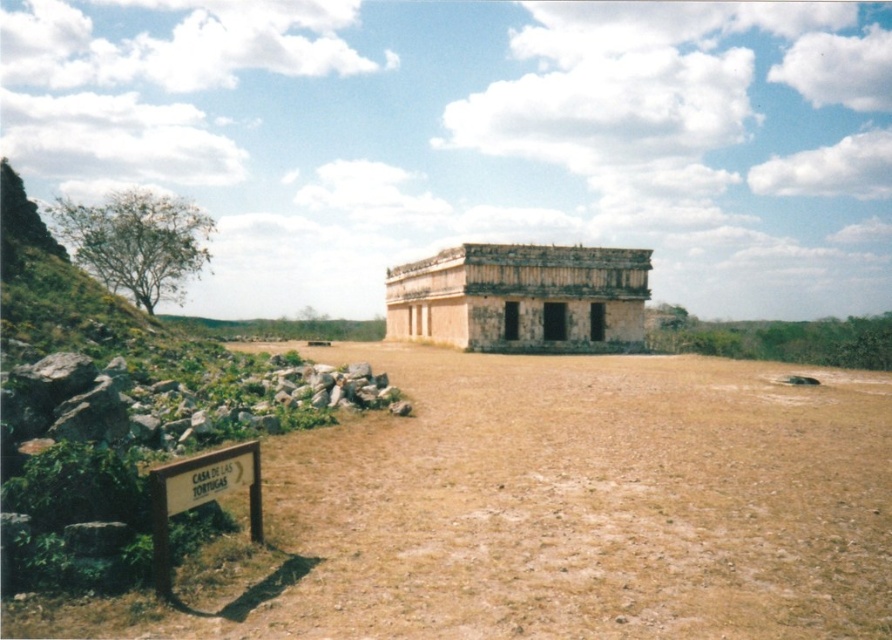
Can you confirm if brown sandy dirt field at center is taller than brown stone at lower left?

Correct, brown sandy dirt field at center is much taller as brown stone at lower left.

At what (x,y) coordinates should I click in order to perform the action: click on brown sandy dirt field at center. Please return your answer as a coordinate pair (x, y). This screenshot has width=892, height=640. Looking at the image, I should click on (558, 509).

Describe the element at coordinates (558, 509) in the screenshot. The height and width of the screenshot is (640, 892). I see `brown sandy dirt field at center` at that location.

This screenshot has height=640, width=892. Find the location of `brown sandy dirt field at center`. brown sandy dirt field at center is located at coordinates (558, 509).

Does brown sandy dirt field at center have a greater width compared to gray rock pile at lower left?

Correct, the width of brown sandy dirt field at center exceeds that of gray rock pile at lower left.

Between brown sandy dirt field at center and gray rock pile at lower left, which one appears on the right side from the viewer's perspective?

From the viewer's perspective, brown sandy dirt field at center appears more on the right side.

Which is in front, point (435, 500) or point (21, 435)?

Point (21, 435) is more forward.

Find the location of a particular element. This screenshot has width=892, height=640. brown sandy dirt field at center is located at coordinates (558, 509).

In the scene shown: Is gray rock pile at lower left shorter than brown stone at lower left?

Incorrect, gray rock pile at lower left's height does not fall short of brown stone at lower left's.

Does point (331, 385) lie in front of point (122, 524)?

No, it is behind (122, 524).

What do you see at coordinates (178, 401) in the screenshot?
I see `gray rock pile at lower left` at bounding box center [178, 401].

Locate an element on the screen. gray rock pile at lower left is located at coordinates (178, 401).